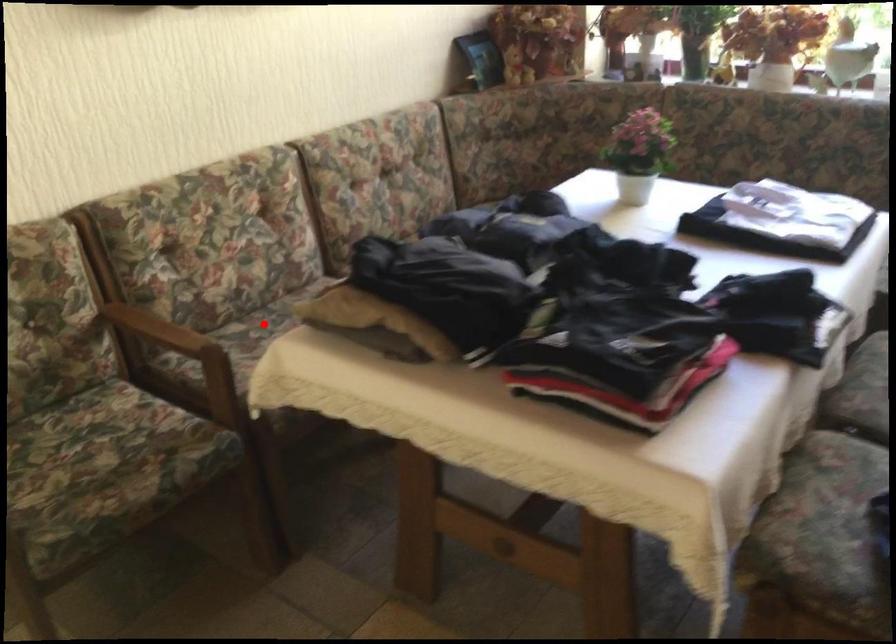
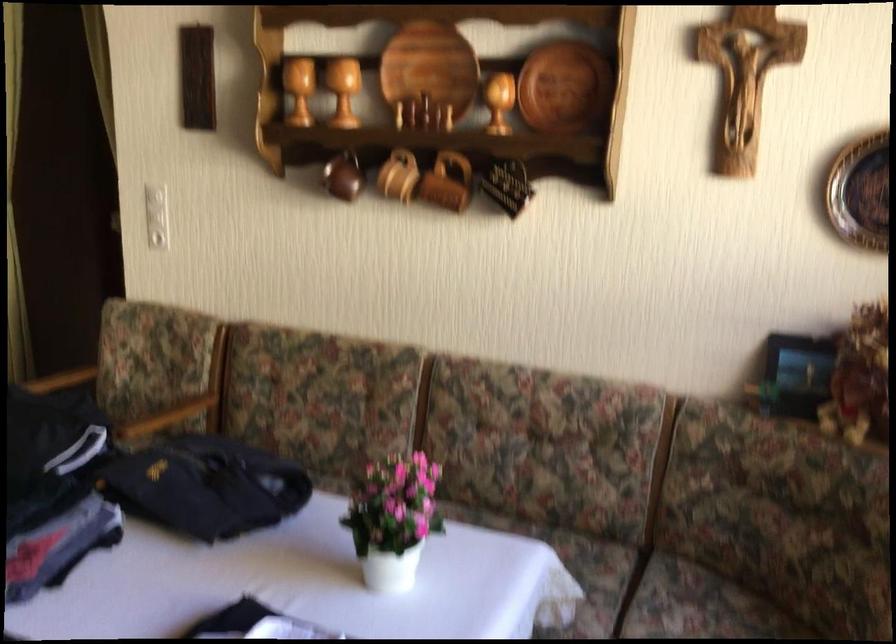
Question: I am providing you with two images of the same scene from different viewpoints. A red point is marked on the first image. Can you still see the location of the red point in image 2?

Choices:
 (A) Yes
 (B) No

Answer: (B)